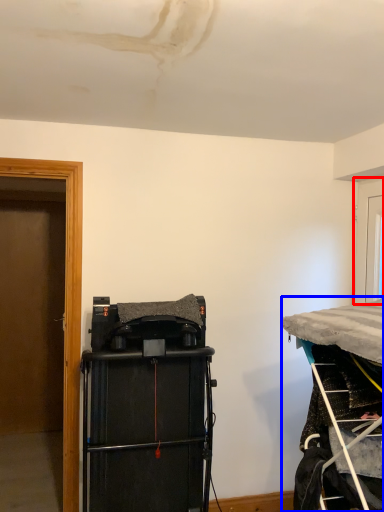
Question: Which of the following is the farthest to the observer, door (highlighted by a red box) or furniture (highlighted by a blue box)?

Choices:
 (A) door
 (B) furniture

Answer: (A)